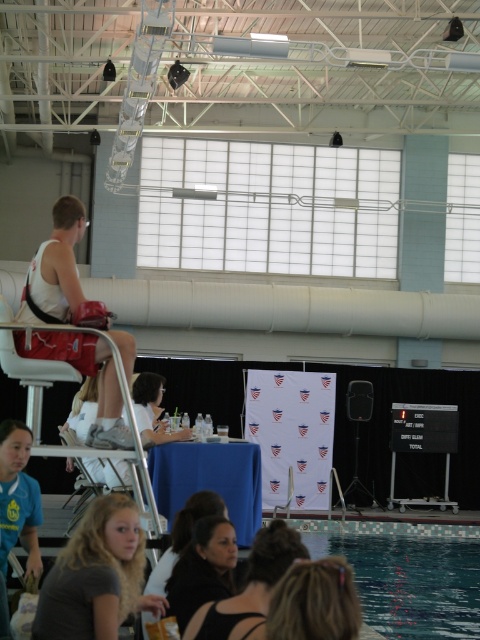
Question: Which is farther from the blonde hair at lower left?

Choices:
 (A) matte white shirt at center
 (B) black fabric hair at center
 (C) blue tile swimming pool at lower center

Answer: (C)

Question: Which point appears farthest from the camera in this image?

Choices:
 (A) (240, 634)
 (B) (457, 632)
 (C) (154, 428)
 (D) (187, 573)

Answer: (C)

Question: Is the position of blue tile swimming pool at lower center less distant than that of black fabric hair at center?

Choices:
 (A) no
 (B) yes

Answer: (A)

Question: Is blue tile swimming pool at lower center further to camera compared to black fabric hair at center?

Choices:
 (A) no
 (B) yes

Answer: (B)

Question: Is blue tile swimming pool at lower center wider than blonde hair at lower center?

Choices:
 (A) yes
 (B) no

Answer: (A)

Question: Which is farther from the black fabric hair at center?

Choices:
 (A) blonde hair at lower center
 (B) blonde hair at lower left
 (C) matte white shirt at center
 (D) blue tile swimming pool at lower center

Answer: (D)